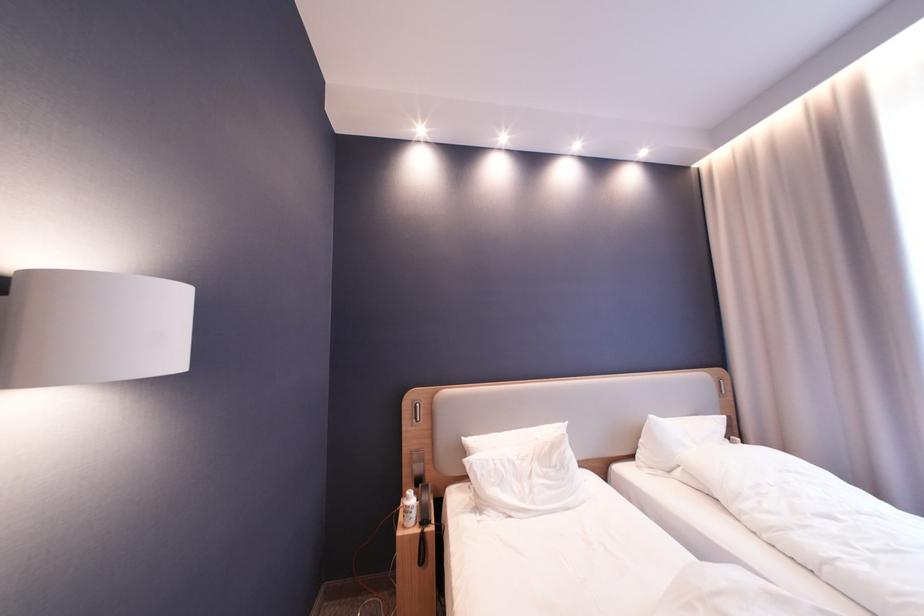
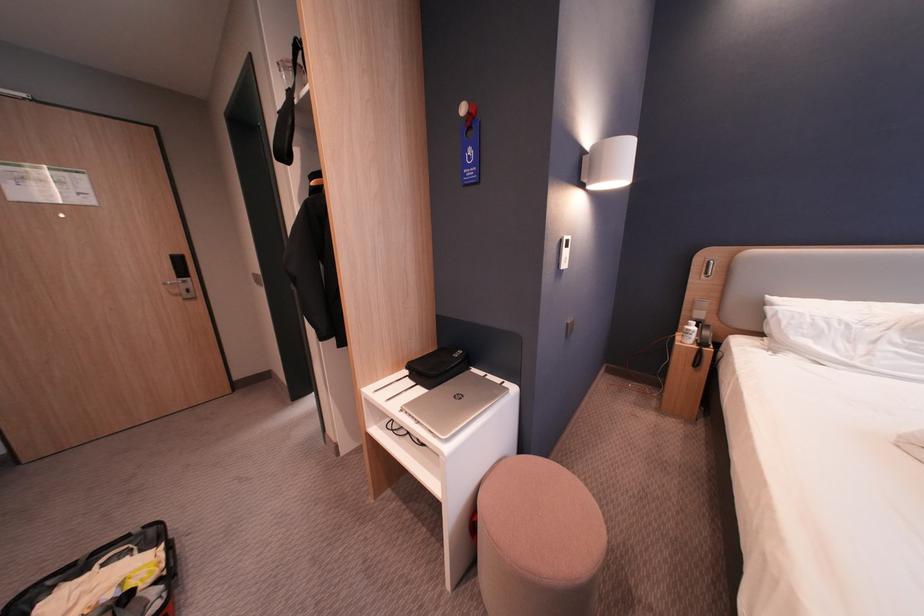
Find the pixel in the second image that matches [417,504] in the first image.

(698, 328)